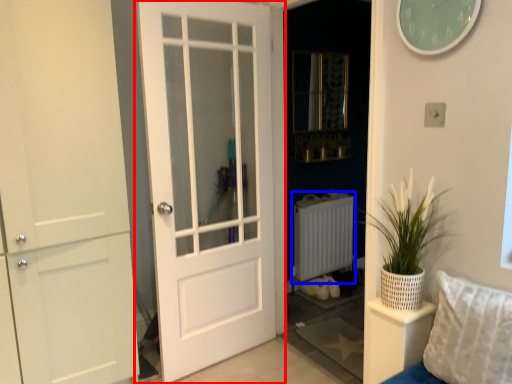
Question: Which point is closer to the camera, door (highlighted by a red box) or radiator (highlighted by a blue box)?

Choices:
 (A) door
 (B) radiator

Answer: (A)